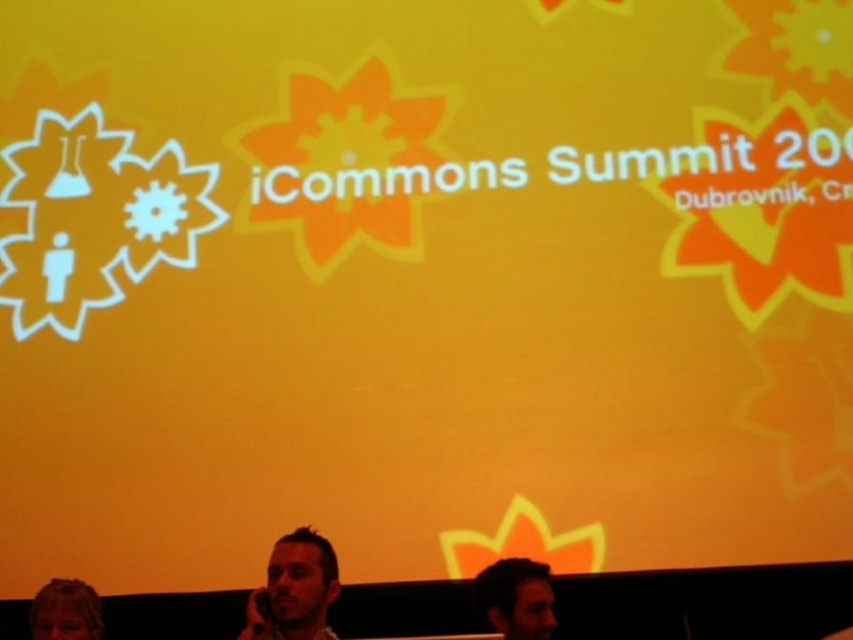
You are standing in front of the presentation screen at the iCommons Summit 20 in Dubrovnik, Cr. You notice two points marked on the screen. The first point is at coordinates point (512, 573) and the second is at point (51, 611). If you were to draw a straight line from your current position to each of these points, which point would require you to look upwards more?

Point (512, 573) is behind point (51, 611), so the line to point (512, 573) would require looking upwards more since it is higher on the screen.

Looking at the conference scene, which person has their hair color positioned to the right of the other? Specifically, is the dark brown hair at lower right located to the right or left of the blonde hair at lower left?

The dark brown hair at lower right is to the right of the blonde hair at lower left.